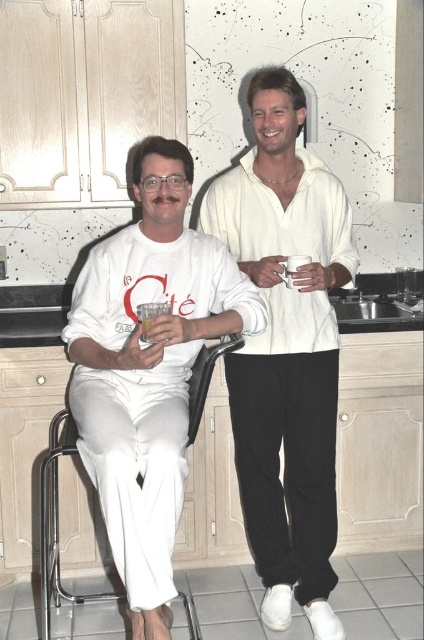
Who is taller, white matte shirt at center or white matte shirt at left?

With more height is white matte shirt at center.

Can you confirm if white matte shirt at center is smaller than white matte shirt at left?

No.

Where is `white matte shirt at center`? white matte shirt at center is located at coordinates (286, 349).

Between white matte shirt at center and translucent glass at left, which one appears on the right side from the viewer's perspective?

white matte shirt at center

Does white matte shirt at center come in front of translucent glass at left?

That is False.

In order to click on white matte shirt at center in this screenshot , I will do `click(286, 349)`.

Is white matte shirt at left further to camera compared to translucent glass at left?

No.

Is white matte shirt at left above translucent glass at left?

Incorrect, white matte shirt at left is not positioned above translucent glass at left.

Image resolution: width=424 pixels, height=640 pixels. Find the location of `white matte shirt at left`. white matte shirt at left is located at coordinates (147, 369).

Find the location of a particular element. The height and width of the screenshot is (640, 424). white matte shirt at left is located at coordinates (147, 369).